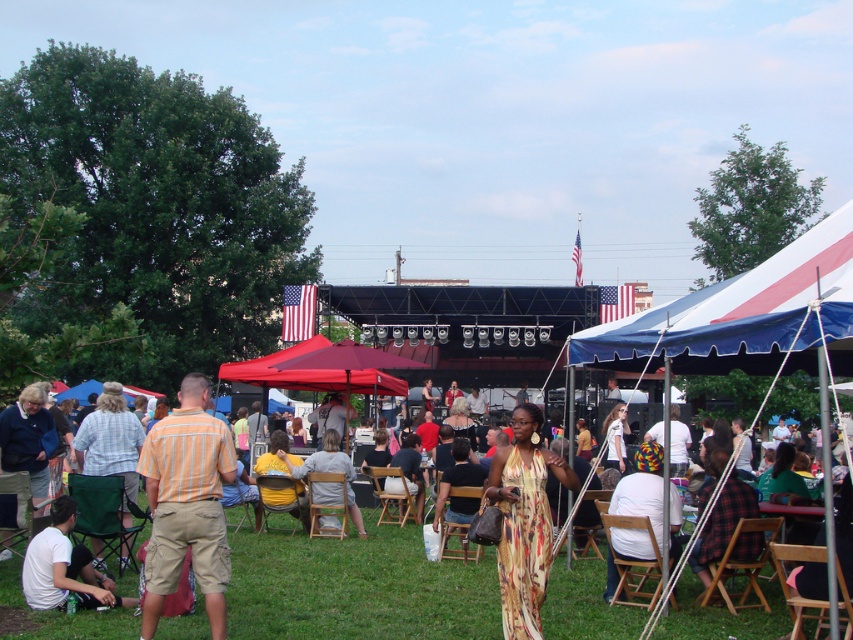
Question: Is blue/white striped canopy at center-right in front of blue/white striped canopy at upper right?

Choices:
 (A) yes
 (B) no

Answer: (B)

Question: Among these points, which one is nearest to the camera?

Choices:
 (A) (51, 572)
 (B) (503, 628)
 (C) (19, 458)
 (D) (833, 624)

Answer: (D)

Question: Considering the real-world distances, which object is closest to the multicolored fabric headscarf at center?

Choices:
 (A) orange striped shirt at center
 (B) blue/white striped canopy at upper right

Answer: (B)

Question: Which of the following is the farthest from the observer?

Choices:
 (A) light brown wood chair at center
 (B) orange striped shirt at center
 (C) blue fleece jacket at lower left

Answer: (A)

Question: Is green grass at center bigger than printed silk dress at center?

Choices:
 (A) yes
 (B) no

Answer: (B)

Question: Does green grass at center have a larger size compared to blue fleece jacket at lower left?

Choices:
 (A) no
 (B) yes

Answer: (A)